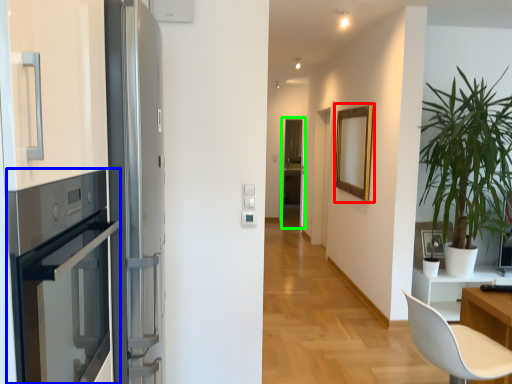
Question: Based on their relative distances, which object is farther from picture frame (highlighted by a red box)? Choose from oven (highlighted by a blue box) and screen door (highlighted by a green box).

Choices:
 (A) oven
 (B) screen door

Answer: (A)